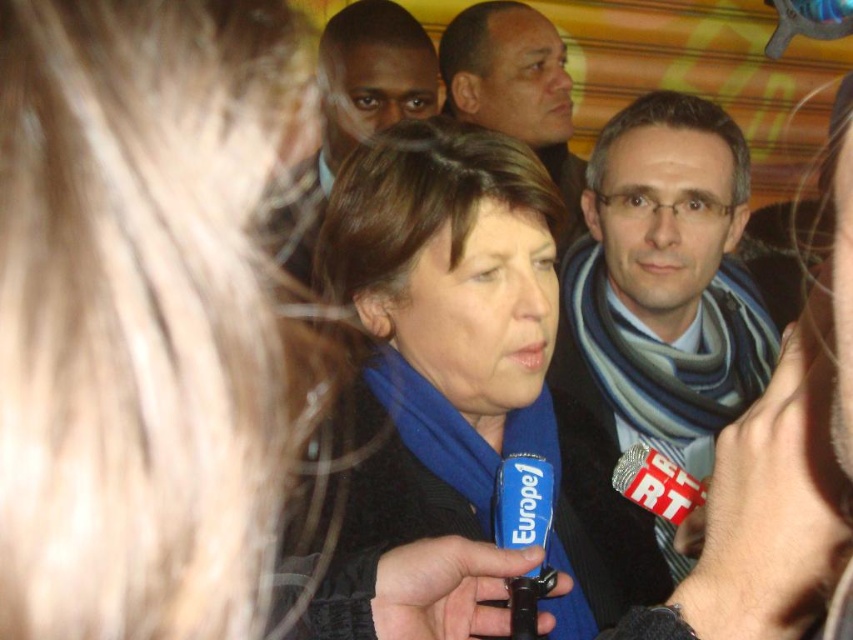
Does point (608, 493) lie in front of point (560, 93)?

Yes, it is in front of point (560, 93).

Between point (514, 413) and point (534, 129), which one is positioned in front?

Point (514, 413) is more forward.

Between point (422, 268) and point (521, 74), which one is positioned in front?

Positioned in front is point (422, 268).

I want to click on blue fabric scarf at center, so click(x=457, y=378).

Is striped scarf at center to the left of smooth brown leather jacket at upper center from the viewer's perspective?

In fact, striped scarf at center is to the right of smooth brown leather jacket at upper center.

The height and width of the screenshot is (640, 853). What do you see at coordinates (664, 282) in the screenshot?
I see `striped scarf at center` at bounding box center [664, 282].

Locate an element on the screen. striped scarf at center is located at coordinates (664, 282).

Does dark brown hair at upper left appear over smooth brown leather jacket at upper center?

Yes, dark brown hair at upper left is above smooth brown leather jacket at upper center.

Measure the distance between point (370, 42) and camera.

Point (370, 42) is 2.19 meters from camera.

What do you see at coordinates (355, 108) in the screenshot?
I see `dark brown hair at upper left` at bounding box center [355, 108].

Locate an element on the screen. dark brown hair at upper left is located at coordinates (x=355, y=108).